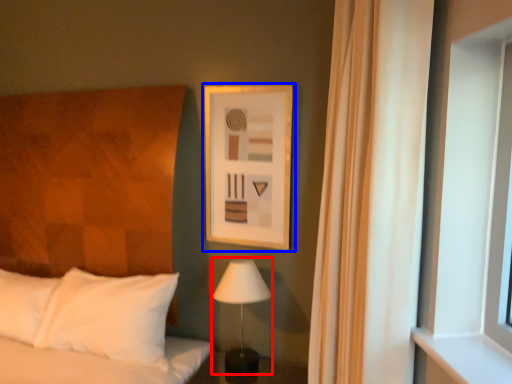
Question: Which point is closer to the camera, table lamp (highlighted by a red box) or picture frame (highlighted by a blue box)?

Choices:
 (A) table lamp
 (B) picture frame

Answer: (A)